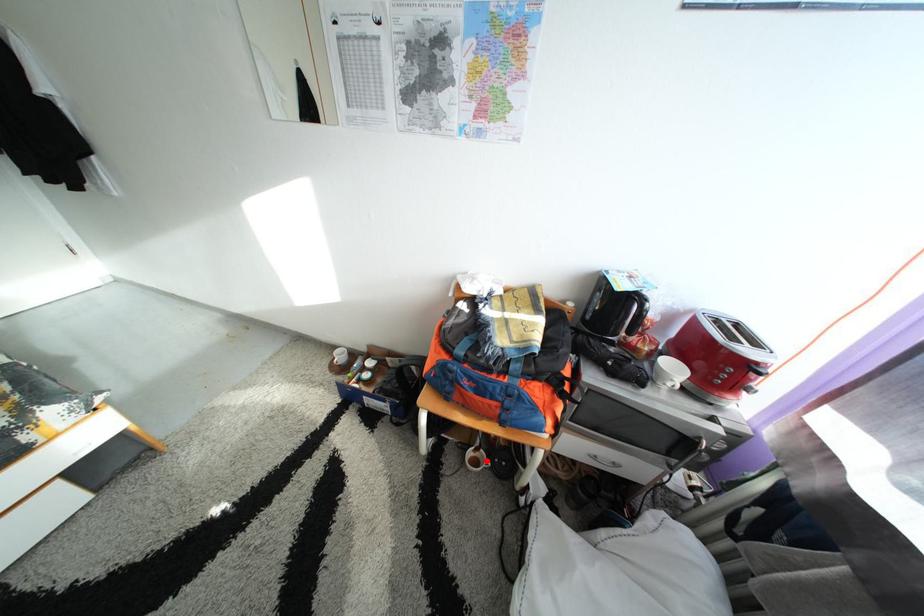
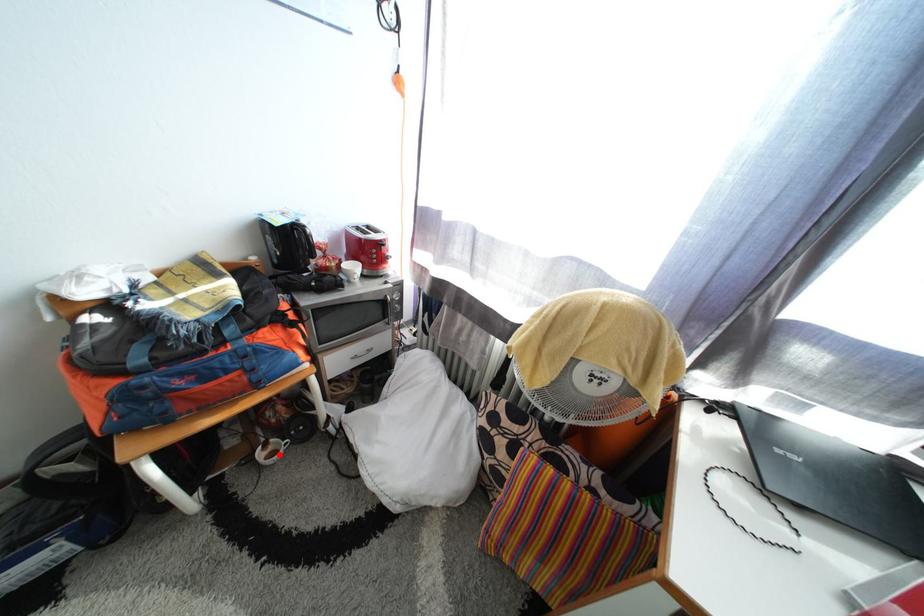
I am providing you with two images of the same scene from different viewpoints. A red point is marked on the first image and another point is marked on the second image. Does the point marked in image1 correspond to the same location as the one in image2?

Yes